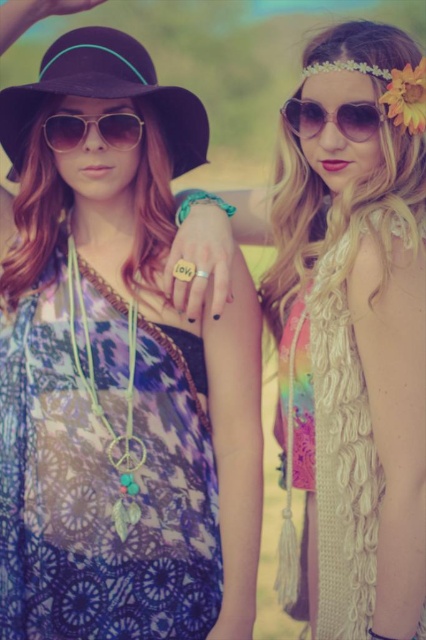
You are a photographer trying to capture a closeup of the white knitted scarf at upper right and the matte black sunglasses at center. Which object should you focus on first if you want to ensure both are in focus?

The white knitted scarf at upper right is closer to the viewer than the matte black sunglasses at center, so focus on the white knitted scarf at upper right first to ensure both are in focus.

In the scene shown: You are taking a photo of the scene and want to ensure the black felt hat at upper left is centered in the frame. Given its current position at coordinates point 0.147, 0.246, what adjustment should you make to the camera to center it?

To center the black felt hat at upper left, adjust the camera so the hat moves from its current position at point (104, 93) to the center coordinates of the frame.

You are standing in the sunny natural setting where the two bohemian people are. You want to move from the point at coordinate point (290, 125) to the point at coordinate point (118, 144). Which direction should you move in to get there?

To move from point (290, 125) to point (118, 144), you should move diagonally downward and to the right since point (290, 125) is in front of point (118, 144).